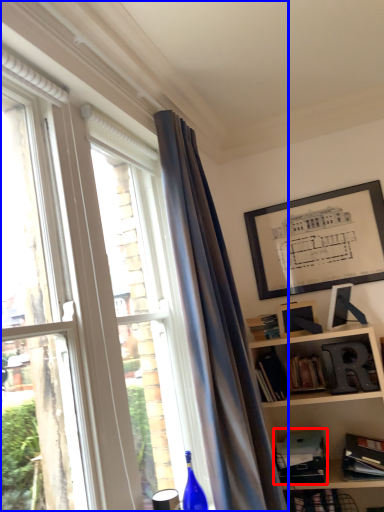
Question: Which of the following is the farthest to the observer, paperback book (highlighted by a red box) or window (highlighted by a blue box)?

Choices:
 (A) paperback book
 (B) window

Answer: (A)